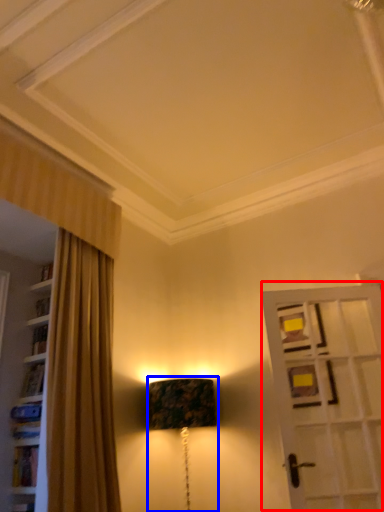
Question: Which point is closer to the camera, door (highlighted by a red box) or table lamp (highlighted by a blue box)?

Choices:
 (A) door
 (B) table lamp

Answer: (A)